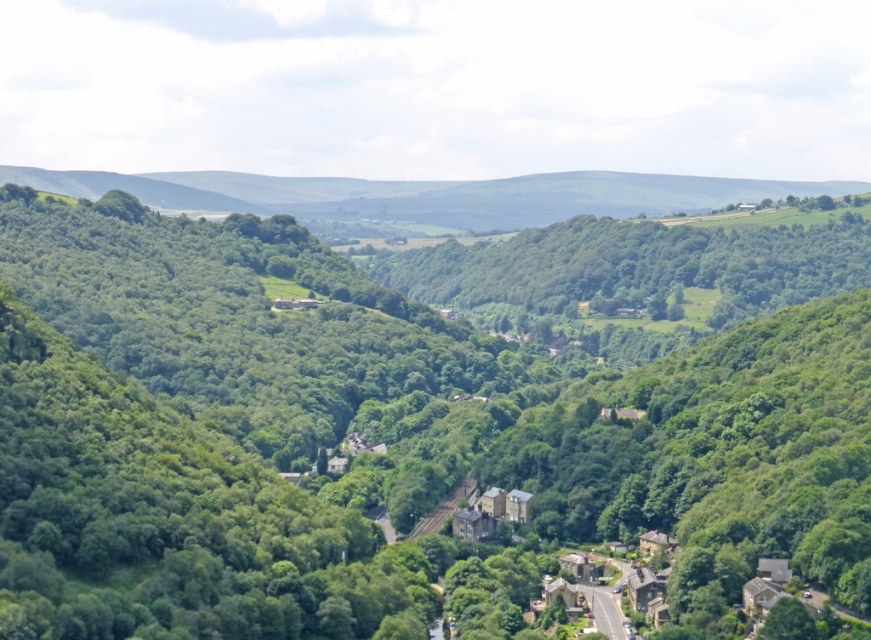
Question: Can you confirm if green leafy tree at center is positioned above green grassy hillside at upper center?

Choices:
 (A) yes
 (B) no

Answer: (B)

Question: Can you confirm if green leafy tree at center is bigger than green grassy hillside at upper center?

Choices:
 (A) yes
 (B) no

Answer: (A)

Question: Is the position of green leafy tree at center less distant than that of green grassy hillside at upper center?

Choices:
 (A) no
 (B) yes

Answer: (B)

Question: Which of the following is the closest to the observer?

Choices:
 (A) (58, 540)
 (B) (541, 193)

Answer: (A)

Question: Which point is farther to the camera?

Choices:
 (A) green grassy hillside at upper center
 (B) green leafy tree at center

Answer: (A)